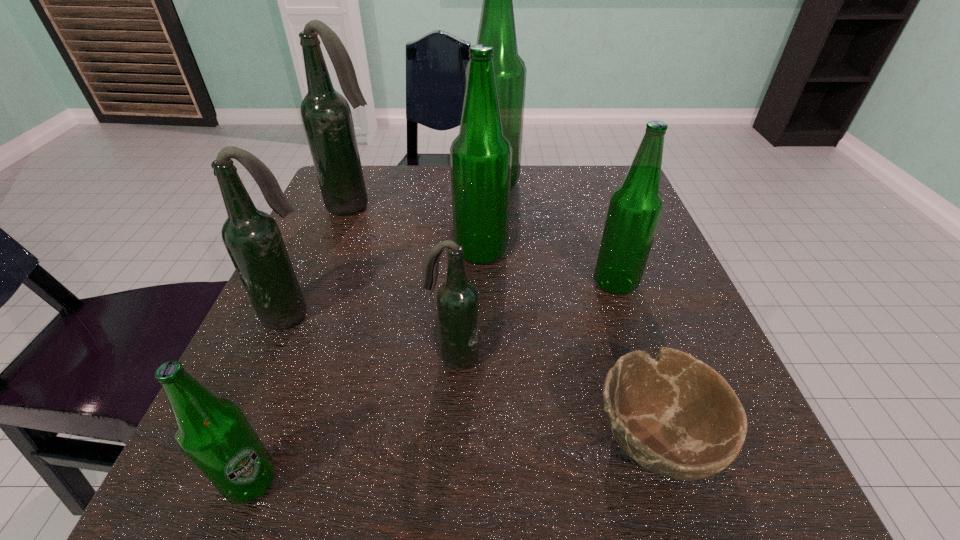
Where is `vacant space located 0.360m on the label of the rightmost green beer bottle`? This screenshot has height=540, width=960. vacant space located 0.360m on the label of the rightmost green beer bottle is located at coordinates (396, 282).

This screenshot has height=540, width=960. I want to click on free space located 0.270m on the label of the rightmost green beer bottle, so click(444, 282).

Identify the location of blank space located on the label of the rightmost green beer bottle. This screenshot has width=960, height=540. (385, 282).

I want to click on vacant space located on the right of the second farthest dark beer bottle, so click(x=423, y=314).

Where is `vacant space positioned on the left of the nearest dark beer bottle`? Image resolution: width=960 pixels, height=540 pixels. vacant space positioned on the left of the nearest dark beer bottle is located at coordinates (318, 357).

Find the location of a particular element. The width and height of the screenshot is (960, 540). free space located on the label of the smallest green beer bottle is located at coordinates (496, 481).

The width and height of the screenshot is (960, 540). Find the location of `free space located 0.060m on the back of the bowl`. free space located 0.060m on the back of the bowl is located at coordinates (628, 352).

At what (x,y) coordinates should I click in order to perform the action: click on beer bottle present at the near edge. Please return your answer as a coordinate pair (x, y). The height and width of the screenshot is (540, 960). Looking at the image, I should click on (214, 433).

Find the location of a particular element. bowl at the near edge is located at coordinates (674, 415).

In order to click on beer bottle that is at the right edge in this screenshot , I will do `click(636, 206)`.